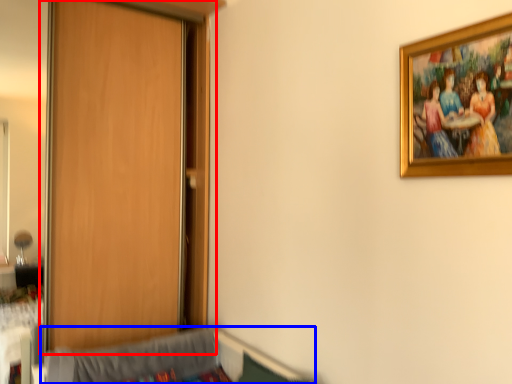
Question: Which of the following is the closest to the observer, door (highlighted by a red box) or hospital bed (highlighted by a blue box)?

Choices:
 (A) door
 (B) hospital bed

Answer: (B)